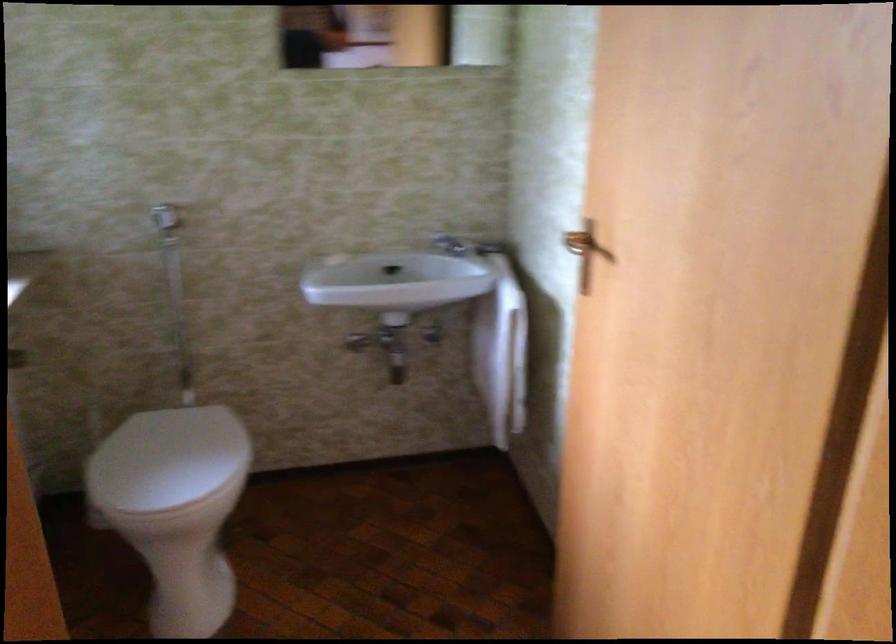
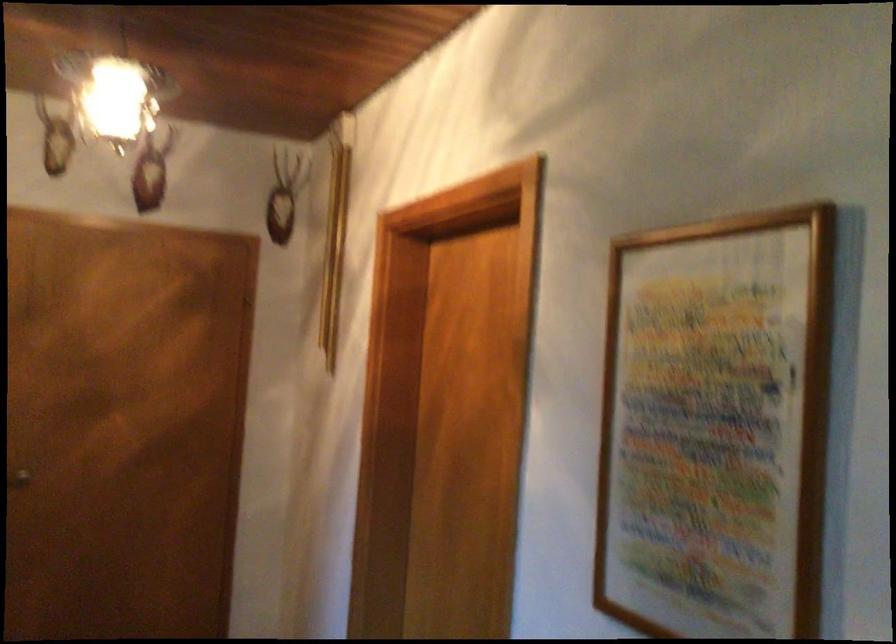
Question: The camera is either moving clockwise (left) or counter-clockwise (right) around the object. The first image is from the beginning of the video and the second image is from the end. Is the camera moving left or right when shooting the video?

Choices:
 (A) Left
 (B) Right

Answer: (A)